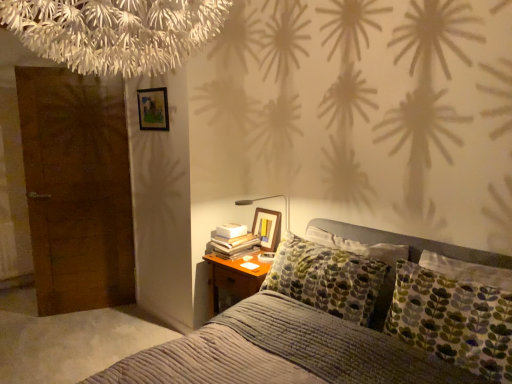
Question: Is white paper book at bedside smaller than textured gray bed at center?

Choices:
 (A) no
 (B) yes

Answer: (B)

Question: Is white paper book at bedside positioned in front of textured gray bed at center?

Choices:
 (A) no
 (B) yes

Answer: (A)

Question: Can you confirm if white paper book at bedside is positioned to the left of textured gray bed at center?

Choices:
 (A) no
 (B) yes

Answer: (B)

Question: Is white paper book at bedside far from textured gray bed at center?

Choices:
 (A) yes
 (B) no

Answer: (B)

Question: Is white paper book at bedside not within textured gray bed at center?

Choices:
 (A) no
 (B) yes

Answer: (B)

Question: Considering the positions of point (226, 251) and point (115, 39), is point (226, 251) closer or farther from the camera than point (115, 39)?

Choices:
 (A) farther
 (B) closer

Answer: (A)

Question: Considering the positions of white paper book at bedside and white fringed chandelier at upper center in the image, is white paper book at bedside taller or shorter than white fringed chandelier at upper center?

Choices:
 (A) tall
 (B) short

Answer: (B)

Question: From the image's perspective, is white paper book at bedside located above or below white fringed chandelier at upper center?

Choices:
 (A) below
 (B) above

Answer: (A)

Question: Is white paper book at bedside spatially inside white fringed chandelier at upper center, or outside of it?

Choices:
 (A) inside
 (B) outside

Answer: (B)

Question: From a real-world perspective, is brown wooden door at left positioned above or below white fringed chandelier at upper center?

Choices:
 (A) below
 (B) above

Answer: (A)

Question: Is point (27, 187) positioned closer to the camera than point (30, 23)?

Choices:
 (A) farther
 (B) closer

Answer: (A)

Question: Considering the positions of brown wooden door at left and white fringed chandelier at upper center in the image, is brown wooden door at left wider or thinner than white fringed chandelier at upper center?

Choices:
 (A) wide
 (B) thin

Answer: (B)

Question: Would you say brown wooden door at left is to the left or to the right of white fringed chandelier at upper center in the picture?

Choices:
 (A) right
 (B) left

Answer: (B)

Question: In terms of width, does wooden picture frame at upper left, which appears as the first picture frame when viewed from the top, look wider or thinner when compared to wooden picture frame at upper right, arranged as the 1th picture frame when ordered from the bottom?

Choices:
 (A) thin
 (B) wide

Answer: (A)

Question: From the image's perspective, is wooden picture frame at upper left, placed as the 1th picture frame when sorted from left to right, positioned above or below wooden picture frame at upper right, arranged as the 1th picture frame when ordered from the bottom?

Choices:
 (A) above
 (B) below

Answer: (A)